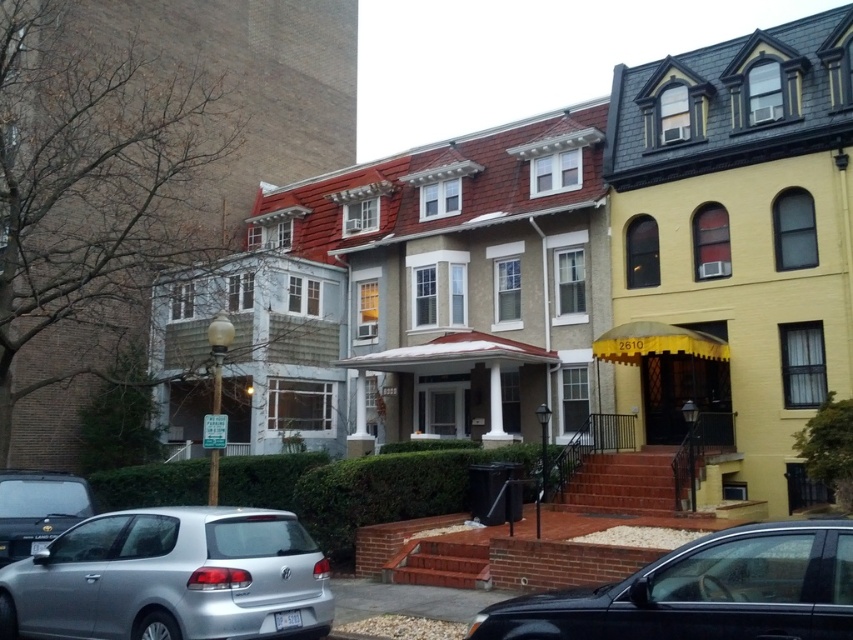
Question: Which point appears farthest from the camera in this image?

Choices:
 (A) (53, 486)
 (B) (219, 536)
 (C) (776, 616)

Answer: (A)

Question: Among these objects, which one is nearest to the camera?

Choices:
 (A) shiny black sedan at lower center
 (B) silver metallic hatchback at lower left

Answer: (A)

Question: Is silver metallic hatchback at lower left smaller than shiny black sedan at lower center?

Choices:
 (A) yes
 (B) no

Answer: (B)

Question: Is silver metallic hatchback at lower left below matte black car at lower left?

Choices:
 (A) no
 (B) yes

Answer: (B)

Question: Which object is closer to the camera taking this photo?

Choices:
 (A) shiny black sedan at lower center
 (B) matte black car at lower left

Answer: (A)

Question: Does shiny black sedan at lower center appear on the right side of matte black car at lower left?

Choices:
 (A) no
 (B) yes

Answer: (B)